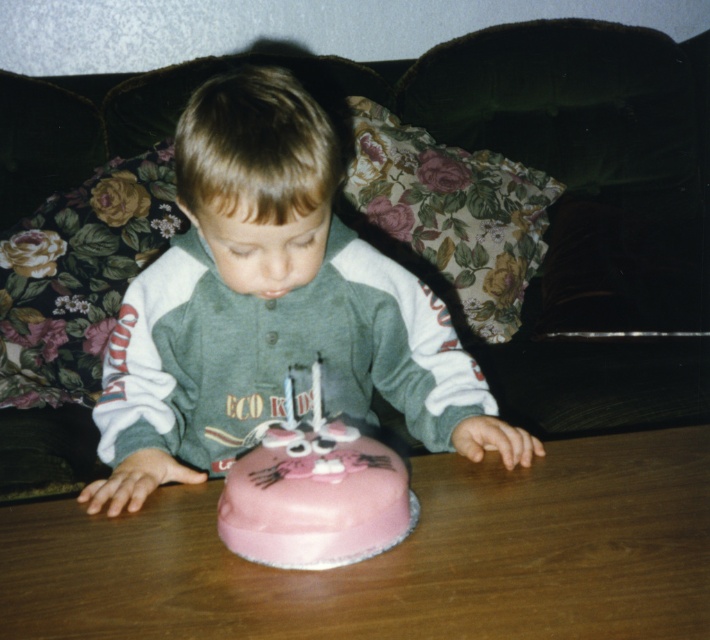
Is pink frosted cake at center closer to camera compared to white paper birthday candle at center?

Yes, pink frosted cake at center is in front of white paper birthday candle at center.

Is pink frosted cake at center positioned behind white paper birthday candle at center?

That is False.

Which is in front, point (273, 496) or point (316, 378)?

Point (273, 496) is in front.

Find the location of a particular element. This screenshot has width=710, height=640. pink frosted cake at center is located at coordinates (315, 499).

Who is more forward, (234, 276) or (315, 428)?

Point (315, 428) is more forward.

Does point (278, 163) come behind point (315, 420)?

That is False.

Find the location of a particular element. matte green sweatshirt at center is located at coordinates (271, 307).

Based on the photo, can you confirm if pink matte cake at center is shorter than pink frosted cake at center?

No, pink matte cake at center is not shorter than pink frosted cake at center.

Is point (114, 572) more distant than point (248, 480)?

No, (114, 572) is closer to viewer.

Locate an element on the screen. Image resolution: width=710 pixels, height=640 pixels. pink matte cake at center is located at coordinates (395, 556).